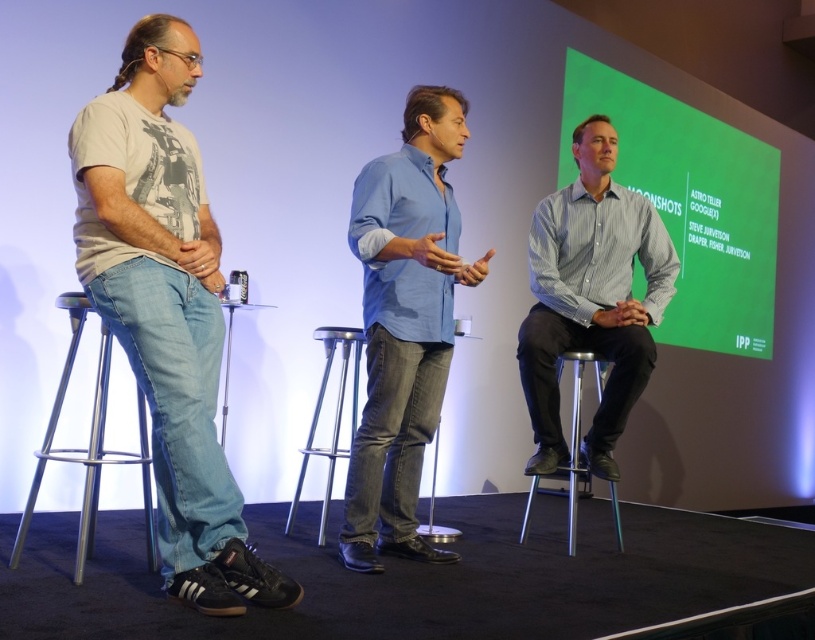
The width and height of the screenshot is (815, 640). Describe the element at coordinates (690, 204) in the screenshot. I see `green matte projection screen at upper center` at that location.

Does green matte projection screen at upper center appear on the right side of silver metallic bar stool at center?

Correct, you'll find green matte projection screen at upper center to the right of silver metallic bar stool at center.

The height and width of the screenshot is (640, 815). Describe the element at coordinates (690, 204) in the screenshot. I see `green matte projection screen at upper center` at that location.

The height and width of the screenshot is (640, 815). Identify the location of green matte projection screen at upper center. (690, 204).

Is gray striped shirt at center above metallic silver bar stool at center?

Indeed, gray striped shirt at center is positioned over metallic silver bar stool at center.

Who is more distant from viewer, (554, 212) or (341, 404)?

Point (554, 212)

Identify the location of gray striped shirt at center. The width and height of the screenshot is (815, 640). (591, 298).

Is point (593, 216) behind point (576, 406)?

That is True.

Where is `gray striped shirt at center`? Image resolution: width=815 pixels, height=640 pixels. gray striped shirt at center is located at coordinates click(591, 298).

The width and height of the screenshot is (815, 640). What do you see at coordinates (591, 298) in the screenshot?
I see `gray striped shirt at center` at bounding box center [591, 298].

Locate an element on the screen. The width and height of the screenshot is (815, 640). gray striped shirt at center is located at coordinates (591, 298).